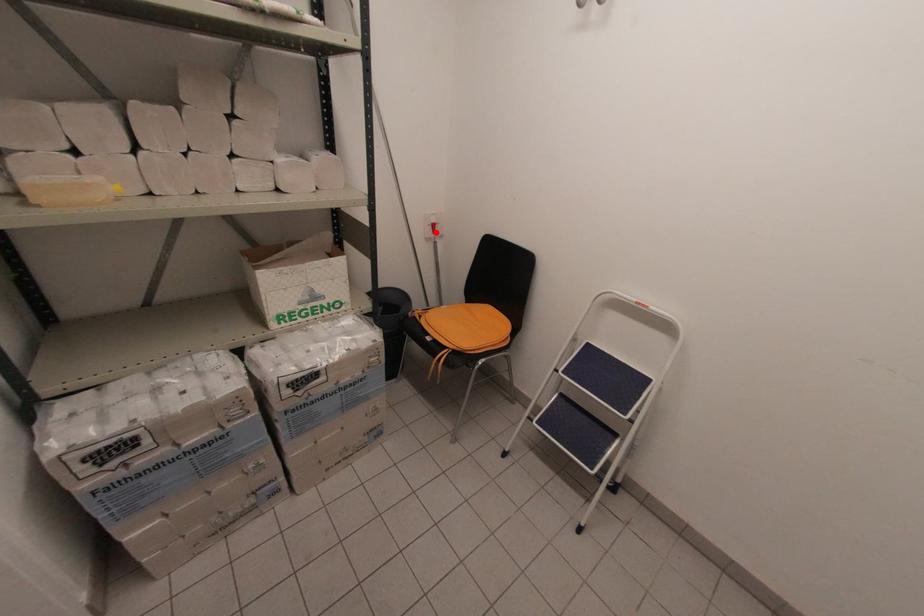
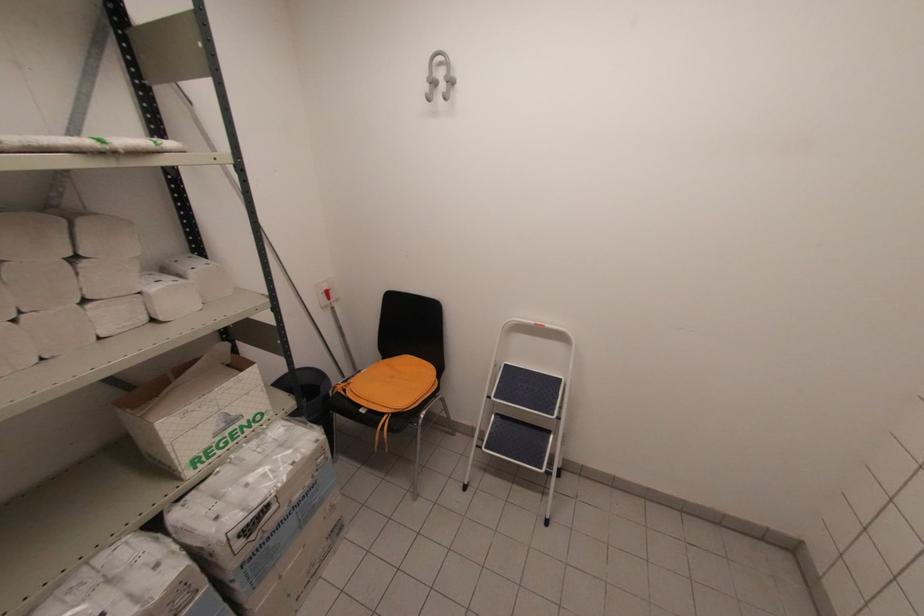
The point at the highlighted location is marked in the first image. Where is the corresponding point in the second image?

(330, 299)